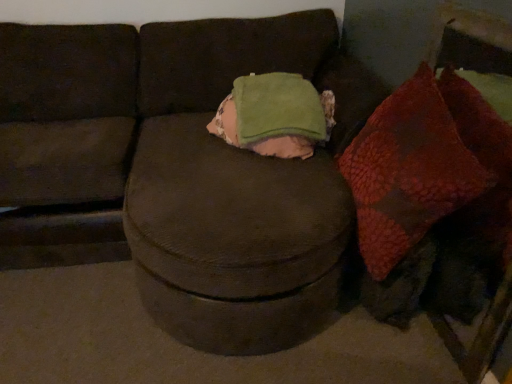
Find the location of a particular element. free space in front of leather-like brown dog at lower right is located at coordinates (392, 360).